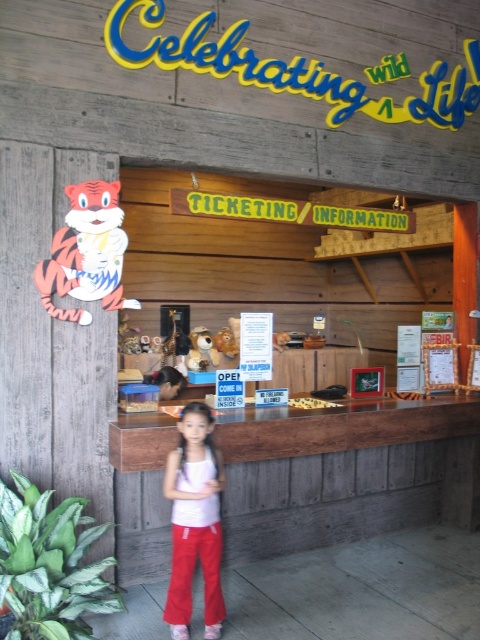
Which is below, white fabric tank top at center or orange paper tiger at left?

white fabric tank top at center is lower down.

Where is `white fabric tank top at center`? The image size is (480, 640). white fabric tank top at center is located at coordinates (194, 522).

Image resolution: width=480 pixels, height=640 pixels. I want to click on white fabric tank top at center, so click(194, 522).

Where is `white fabric tank top at center`? Image resolution: width=480 pixels, height=640 pixels. white fabric tank top at center is located at coordinates (194, 522).